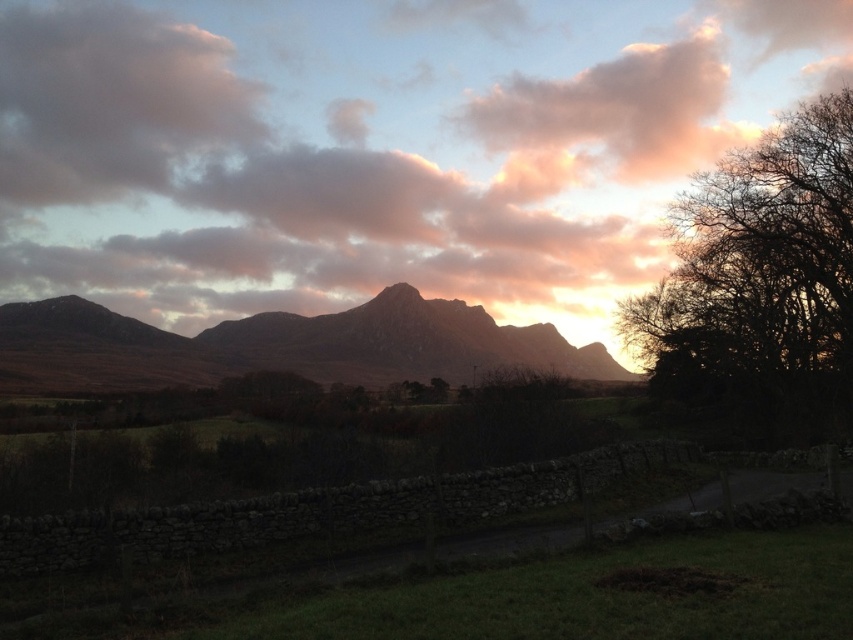
Who is positioned more to the right, pink fluffy cloud at upper center or rugged brown mountain at center?

pink fluffy cloud at upper center is more to the right.

Where is `pink fluffy cloud at upper center`? pink fluffy cloud at upper center is located at coordinates (376, 147).

Is pink fluffy cloud at upper center positioned behind silhouette bare tree at right?

Yes, it is behind silhouette bare tree at right.

Image resolution: width=853 pixels, height=640 pixels. What do you see at coordinates (376, 147) in the screenshot?
I see `pink fluffy cloud at upper center` at bounding box center [376, 147].

At what (x,y) coordinates should I click in order to perform the action: click on pink fluffy cloud at upper center. Please return your answer as a coordinate pair (x, y). Looking at the image, I should click on (376, 147).

Does silhouette bare tree at right appear on the right side of rugged brown mountain at center?

Yes, silhouette bare tree at right is to the right of rugged brown mountain at center.

The height and width of the screenshot is (640, 853). Describe the element at coordinates (761, 282) in the screenshot. I see `silhouette bare tree at right` at that location.

The height and width of the screenshot is (640, 853). Find the location of `silhouette bare tree at right`. silhouette bare tree at right is located at coordinates (761, 282).